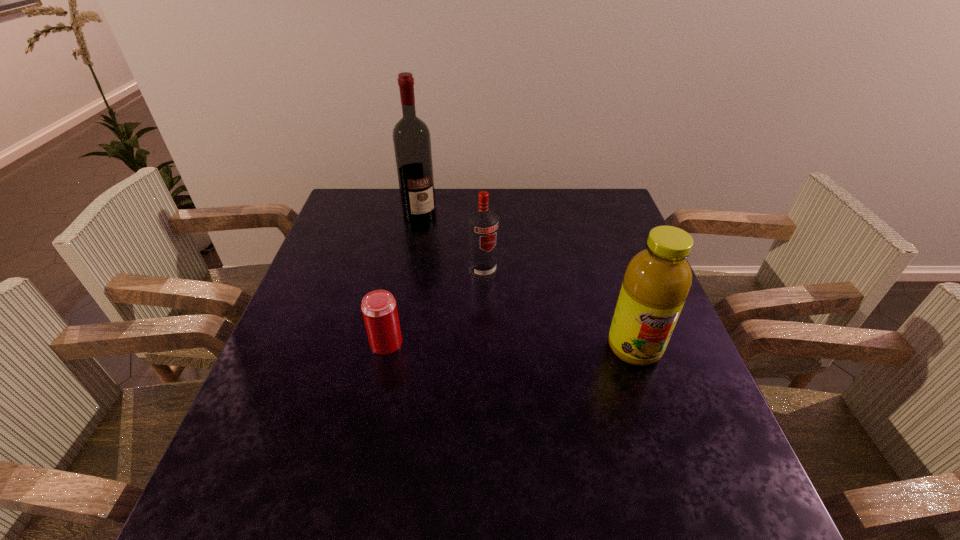
Image resolution: width=960 pixels, height=540 pixels. Identify the location of the shortest object. (379, 309).

This screenshot has width=960, height=540. I want to click on fruit juice, so click(x=657, y=280).

Find the location of `the rightmost object`. the rightmost object is located at coordinates (657, 280).

I want to click on the second shortest object, so click(x=483, y=224).

Identify the location of vodka. This screenshot has width=960, height=540. (483, 224).

At what (x,y) coordinates should I click in order to perform the action: click on the farthest object. Please return your answer as a coordinate pair (x, y). Looking at the image, I should click on (412, 144).

At what (x,y) coordinates should I click in order to perform the action: click on the tallest object. Please return your answer as a coordinate pair (x, y). The image size is (960, 540). Looking at the image, I should click on (412, 144).

This screenshot has height=540, width=960. What are the coordinates of `free space located 0.070m on the front of the shortest object` in the screenshot? It's located at (378, 382).

This screenshot has height=540, width=960. I want to click on vacant region located 0.190m on the front label of the fruit juice, so click(671, 454).

In order to click on free space located 0.160m on the front label of the vodka in this screenshot , I will do `click(515, 322)`.